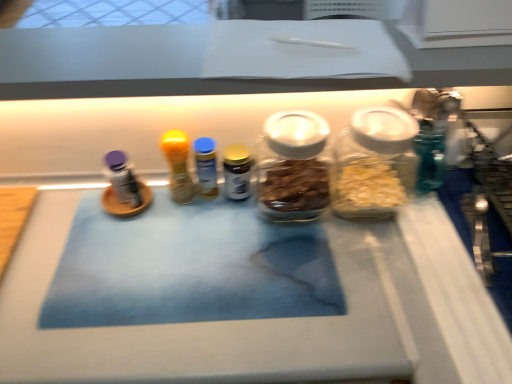
You are a GUI agent. You are given a task and a screenshot of the screen. Output one action in this format:
    pyautogui.click(x=<x>, y=<y>)
    Task: Click on the vacant area on top of blue marble table at center (from a real-world perspective)
    The image size is (512, 384).
    Given the screenshot: What is the action you would take?
    pyautogui.click(x=152, y=266)